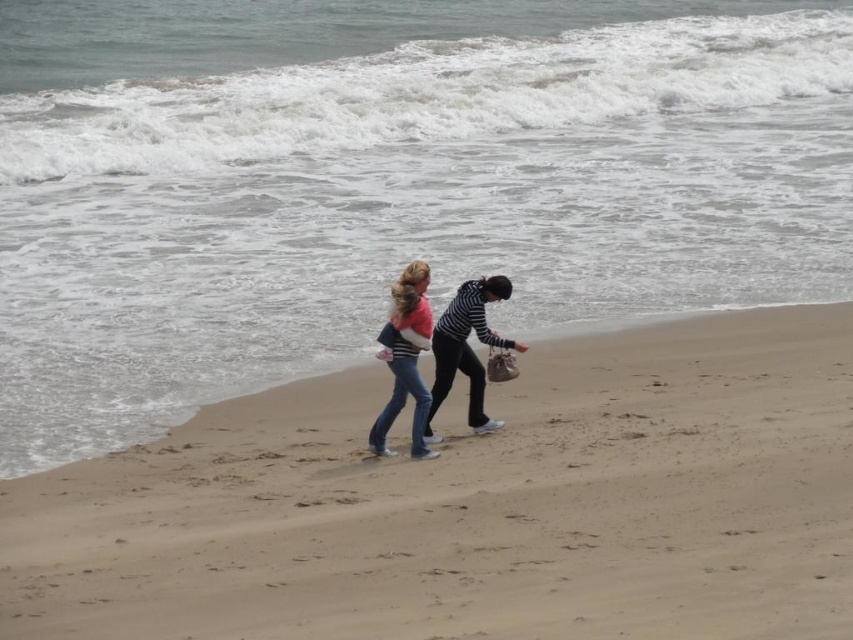
Based on the photo, who is positioned more to the left, sandy beach at lower center or striped fabric sweater at center?

striped fabric sweater at center is more to the left.

In order to click on sandy beach at lower center in this screenshot , I will do `click(474, 504)`.

Between point (637, 394) and point (444, 387), which one is positioned behind?

Positioned behind is point (637, 394).

You are a GUI agent. You are given a task and a screenshot of the screen. Output one action in this format:
    pyautogui.click(x=<x>, y=<y>)
    Task: Click on the sandy beach at lower center
    
    Given the screenshot: What is the action you would take?
    pyautogui.click(x=474, y=504)

Between point (415, 333) and point (428, 339), which one is positioned in front?

Point (415, 333) is more forward.

Identify the location of striped fabric sweater at center. The image size is (853, 640). point(434,353).

Is point (421, 321) in front of point (419, 444)?

That is True.

The height and width of the screenshot is (640, 853). Identify the location of striped fabric sweater at center. (434, 353).

Which is behind, point (422, 586) or point (393, 339)?

The point (393, 339) is more distant.

Between sandy beach at lower center and denim jeans at center, which one is positioned higher?

denim jeans at center is above.

Is point (294, 413) closer to camera compared to point (421, 346)?

That is False.

Where is `sandy beach at lower center`? The image size is (853, 640). sandy beach at lower center is located at coordinates (474, 504).